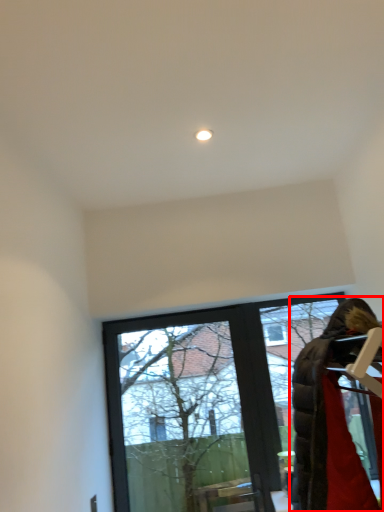
Question: From the image's perspective, what is the correct spatial positioning of woman (annotated by the red box) in reference to window?

Choices:
 (A) above
 (B) below

Answer: (A)